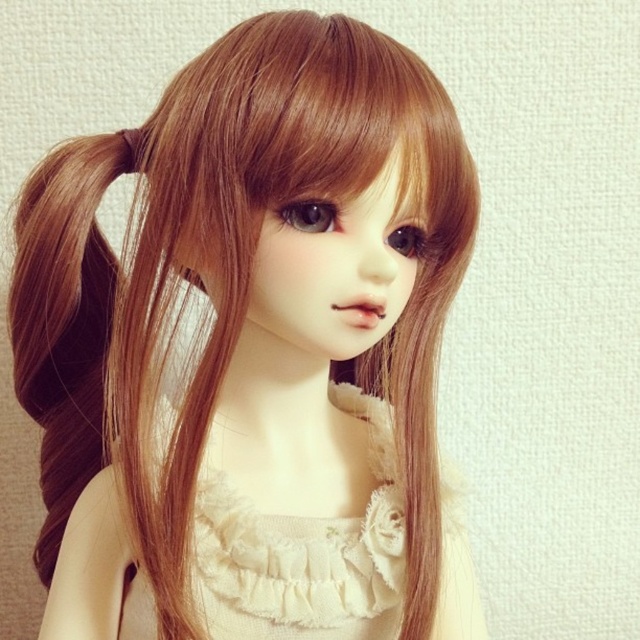
You are a tailor who needs to place a button at point (305, 554). The doll is wearing a cream colored top with ruffled details around the neckline and a light beige lace dress at center. Where should you place the button?

The point (305, 554) is on the light beige lace dress at center, so you should place the button on the light beige lace dress at center.

You are a photographer adjusting the focus on your camera. You want to ensure that both the light beige lace dress at center and the brown silky hair at left are in focus. Which object should you focus on first to achieve this?

To ensure both the light beige lace dress at center and the brown silky hair at left are in focus, you should focus on the light beige lace dress at center first since it is closer to the viewer. This allows the depth of field to extend backward to include the brown silky hair at left.

You are a tailor measuring the distance between the light beige lace dress at center and the brown silky hair at left for a custom alteration. The minimum required space for the alteration is 8 inches. Can you confirm if there is enough space between them?

The light beige lace dress at center and the brown silky hair at left are 8.49 inches apart, which is more than the required 8 inches. Therefore, there is enough space for the alteration.